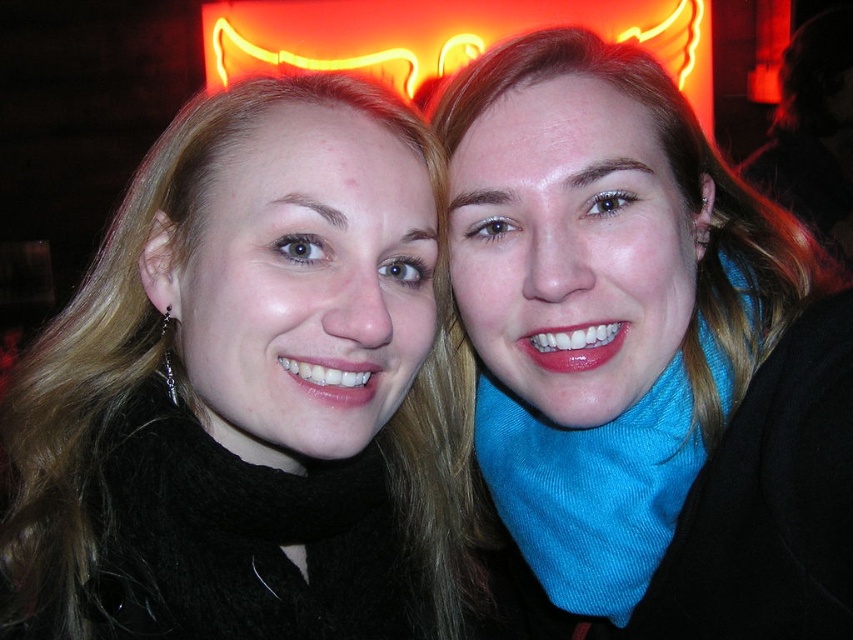
Between black fuzzy scarf at upper center and blue corduroy scarf at center, which one is positioned lower?

black fuzzy scarf at upper center

Who is positioned more to the right, black fuzzy scarf at upper center or blue corduroy scarf at center?

blue corduroy scarf at center

Between point (206, 396) and point (572, 163), which one is positioned in front?

Point (206, 396) is in front.

Locate an element on the screen. black fuzzy scarf at upper center is located at coordinates (252, 390).

Is blue corduroy scarf at center positioned in front of blue corduroy scarf at right?

Yes, blue corduroy scarf at center is in front of blue corduroy scarf at right.

Does blue corduroy scarf at center have a larger size compared to blue corduroy scarf at right?

Correct, blue corduroy scarf at center is larger in size than blue corduroy scarf at right.

The width and height of the screenshot is (853, 640). What are the coordinates of `blue corduroy scarf at center` in the screenshot? It's located at (643, 356).

Identify the location of blue corduroy scarf at center. This screenshot has width=853, height=640. (643, 356).

Does blue corduroy scarf at right appear on the right side of neon yellow sign at upper center?

Correct, you'll find blue corduroy scarf at right to the right of neon yellow sign at upper center.

Can you confirm if blue corduroy scarf at right is positioned below neon yellow sign at upper center?

Yes.

What do you see at coordinates (590, 490) in the screenshot?
I see `blue corduroy scarf at right` at bounding box center [590, 490].

Find the location of `blue corduroy scarf at right`. blue corduroy scarf at right is located at coordinates (590, 490).